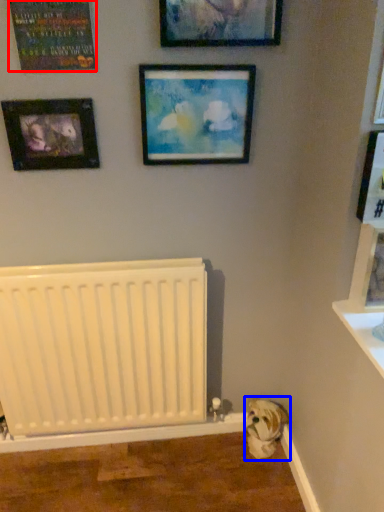
Question: Which of the following is the farthest to the observer, picture frame (highlighted by a red box) or animal (highlighted by a blue box)?

Choices:
 (A) picture frame
 (B) animal

Answer: (B)